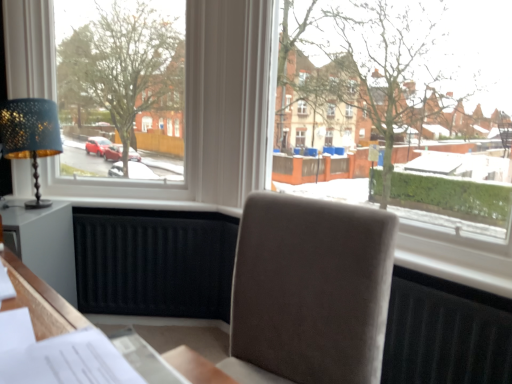
Question: Is suede-like beige chair at center thinner than white plastic window at upper left, the 2th window positioned from the right?

Choices:
 (A) no
 (B) yes

Answer: (A)

Question: Does suede-like beige chair at center lie behind white plastic window at upper left, which is counted as the first window, starting from the left?

Choices:
 (A) no
 (B) yes

Answer: (A)

Question: Is suede-like beige chair at center bigger than white plastic window at upper left, which is counted as the first window, starting from the left?

Choices:
 (A) yes
 (B) no

Answer: (B)

Question: Is the position of suede-like beige chair at center less distant than that of white plastic window at upper left, which is counted as the first window, starting from the left?

Choices:
 (A) yes
 (B) no

Answer: (A)

Question: Can you confirm if suede-like beige chair at center is wider than white plastic window at upper left, the 2th window positioned from the right?

Choices:
 (A) no
 (B) yes

Answer: (B)

Question: Considering the relative sizes of suede-like beige chair at center and white plastic window at upper left, the 2th window positioned from the right, in the image provided, is suede-like beige chair at center shorter than white plastic window at upper left, the 2th window positioned from the right,?

Choices:
 (A) no
 (B) yes

Answer: (B)

Question: From a real-world perspective, is transparent glass window at center, acting as the 2th window starting from the left, positioned over matte gold table lamp at left based on gravity?

Choices:
 (A) no
 (B) yes

Answer: (B)

Question: From the image's perspective, is transparent glass window at center, placed as the 1th window when sorted from right to left, over matte gold table lamp at left?

Choices:
 (A) no
 (B) yes

Answer: (B)

Question: From a real-world perspective, is transparent glass window at center, acting as the 2th window starting from the left, under matte gold table lamp at left?

Choices:
 (A) yes
 (B) no

Answer: (B)

Question: From the image's perspective, is transparent glass window at center, acting as the 2th window starting from the left, below matte gold table lamp at left?

Choices:
 (A) no
 (B) yes

Answer: (A)

Question: Is transparent glass window at center, acting as the 2th window starting from the left, aimed at matte gold table lamp at left?

Choices:
 (A) no
 (B) yes

Answer: (A)

Question: Is transparent glass window at center, acting as the 2th window starting from the left, looking in the opposite direction of matte gold table lamp at left?

Choices:
 (A) no
 (B) yes

Answer: (A)

Question: Is suede-like beige chair at center at the back of white paper at lower left?

Choices:
 (A) no
 (B) yes

Answer: (A)